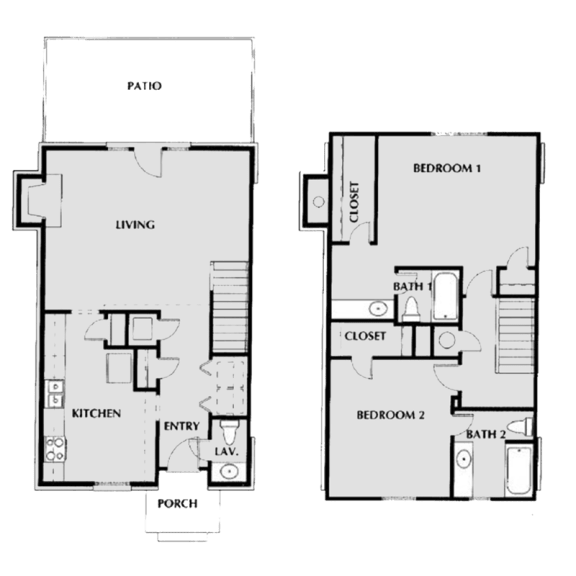
Locate an element on the screen. This screenshot has height=576, width=576. toilets is located at coordinates (522, 430), (226, 432), (410, 306).